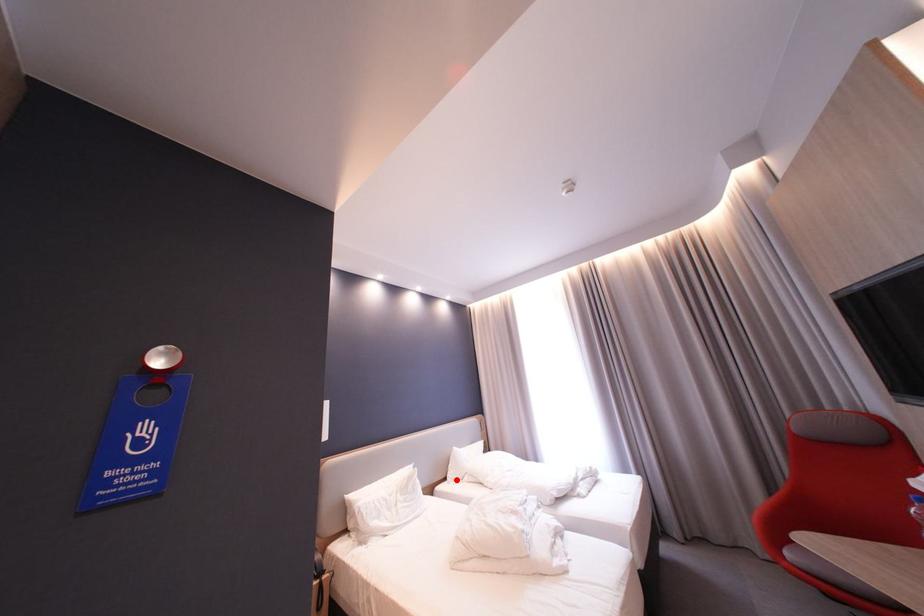
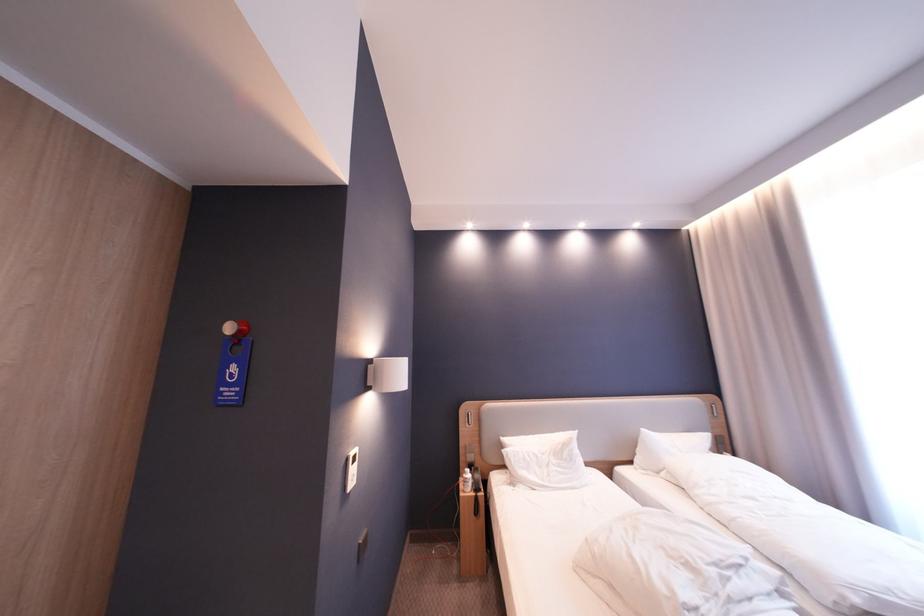
Question: I am providing you with two images of the same scene from different viewpoints. Image1 has a red point marked. In image2, the corresponding 3D location appears at what relative position? Reply with the corresponding letter.

Choices:
 (A) Closer
 (B) Farther

Answer: (A)